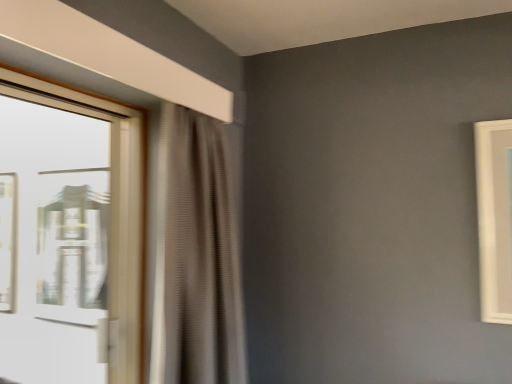
Measure the distance between clear glass window at left and camera.

The distance of clear glass window at left from camera is 4.38 feet.

What is the approximate width of clear glass window at left?

It is 3.80 inches.

This screenshot has height=384, width=512. What do you see at coordinates (69, 236) in the screenshot?
I see `clear glass window at left` at bounding box center [69, 236].

At what (x,y) coordinates should I click in order to perform the action: click on clear glass window at left. Please return your answer as a coordinate pair (x, y). The height and width of the screenshot is (384, 512). Looking at the image, I should click on pos(69,236).

The image size is (512, 384). I want to click on beige textured curtain at left, so click(196, 256).

What do you see at coordinates (196, 256) in the screenshot?
I see `beige textured curtain at left` at bounding box center [196, 256].

Where is `clear glass window at left`? The image size is (512, 384). clear glass window at left is located at coordinates click(69, 236).

Is clear glass window at left to the left or to the right of beige textured curtain at left in the image?

In the image, clear glass window at left appears on the left side of beige textured curtain at left.

Looking at this image, which object is closer to the camera taking this photo, clear glass window at left or beige textured curtain at left?

clear glass window at left is more forward.

Considering the positions of point (92, 212) and point (191, 299), is point (92, 212) closer or farther from the camera than point (191, 299)?

Point (92, 212) appears to be farther away from the viewer than point (191, 299).

From the image's perspective, would you say clear glass window at left is shown under beige textured curtain at left?

Actually, clear glass window at left appears above beige textured curtain at left in the image.

From a real-world perspective, is clear glass window at left physically below beige textured curtain at left?

No, from a real-world perspective, clear glass window at left is not below beige textured curtain at left.

Between clear glass window at left and beige textured curtain at left, which one has smaller width?

Thinner between the two is clear glass window at left.

Considering the relative sizes of clear glass window at left and beige textured curtain at left in the image provided, is clear glass window at left taller than beige textured curtain at left?

In fact, clear glass window at left may be shorter than beige textured curtain at left.

In terms of size, does clear glass window at left appear bigger or smaller than beige textured curtain at left?

In the image, clear glass window at left appears to be smaller than beige textured curtain at left.

Is clear glass window at left completely or partially outside of beige textured curtain at left?

Yes, clear glass window at left is outside of beige textured curtain at left.

Is there a large distance between clear glass window at left and beige textured curtain at left?

clear glass window at left is near beige textured curtain at left, not far away.

Is clear glass window at left positioned with its back to beige textured curtain at left?

clear glass window at left is not turned away from beige textured curtain at left.

How far apart are clear glass window at left and beige textured curtain at left?

clear glass window at left and beige textured curtain at left are 65.08 centimeters apart from each other.

Locate an element on the screen. Image resolution: width=512 pixels, height=384 pixels. window above the beige textured curtain at left (from a real-world perspective) is located at coordinates (69, 236).

In the image, is beige textured curtain at left on the left side or the right side of clear glass window at left?

In the image, beige textured curtain at left appears on the right side of clear glass window at left.

Does beige textured curtain at left lie behind clear glass window at left?

Yes, it is behind clear glass window at left.

Is point (223, 331) less distant than point (85, 367)?

Yes, it is in front of point (85, 367).

From the image's perspective, is beige textured curtain at left positioned above or below clear glass window at left?

beige textured curtain at left is below clear glass window at left.

From a real-world perspective, is beige textured curtain at left below clear glass window at left?

Correct, in the physical world, beige textured curtain at left is lower than clear glass window at left.

Looking at their sizes, would you say beige textured curtain at left is wider or thinner than clear glass window at left?

beige textured curtain at left is wider than clear glass window at left.

Which of these two, beige textured curtain at left or clear glass window at left, stands taller?

Standing taller between the two is beige textured curtain at left.

Who is smaller, beige textured curtain at left or clear glass window at left?

clear glass window at left is smaller.

Is clear glass window at left inside beige textured curtain at left?

No, clear glass window at left is not a part of beige textured curtain at left.

Are beige textured curtain at left and clear glass window at left beside each other?

No.

Is beige textured curtain at left facing towards clear glass window at left?

No, beige textured curtain at left does not turn towards clear glass window at left.

Can you tell me how much beige textured curtain at left and clear glass window at left differ in facing direction?

There is a 0.798-degree angle between the facing directions of beige textured curtain at left and clear glass window at left.

Measure the distance between beige textured curtain at left and clear glass window at left.

beige textured curtain at left is 25.62 inches from clear glass window at left.

The image size is (512, 384). In order to click on curtain below the clear glass window at left (from the image's perspective) in this screenshot , I will do [x=196, y=256].

Image resolution: width=512 pixels, height=384 pixels. Identify the location of window that appears above the beige textured curtain at left (from a real-world perspective). (69, 236).

What are the coordinates of `curtain that is behind the clear glass window at left` in the screenshot? It's located at (196, 256).